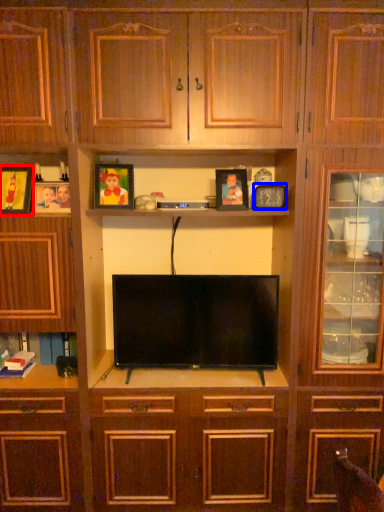
Question: Among these objects, which one is nearest to the camera, picture frame (highlighted by a red box) or picture frame (highlighted by a blue box)?

Choices:
 (A) picture frame
 (B) picture frame

Answer: (A)